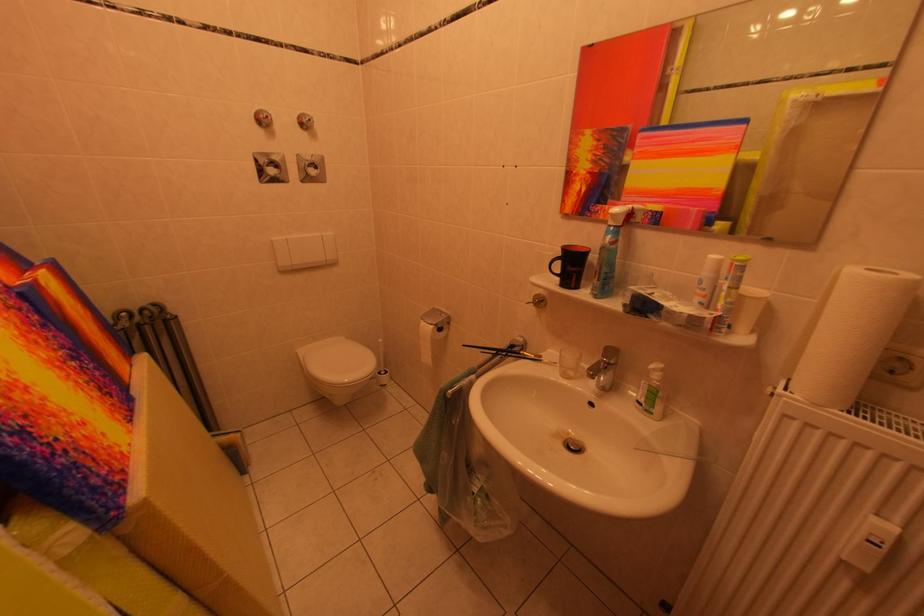
Identify the location of small glass cup. coord(569,362).